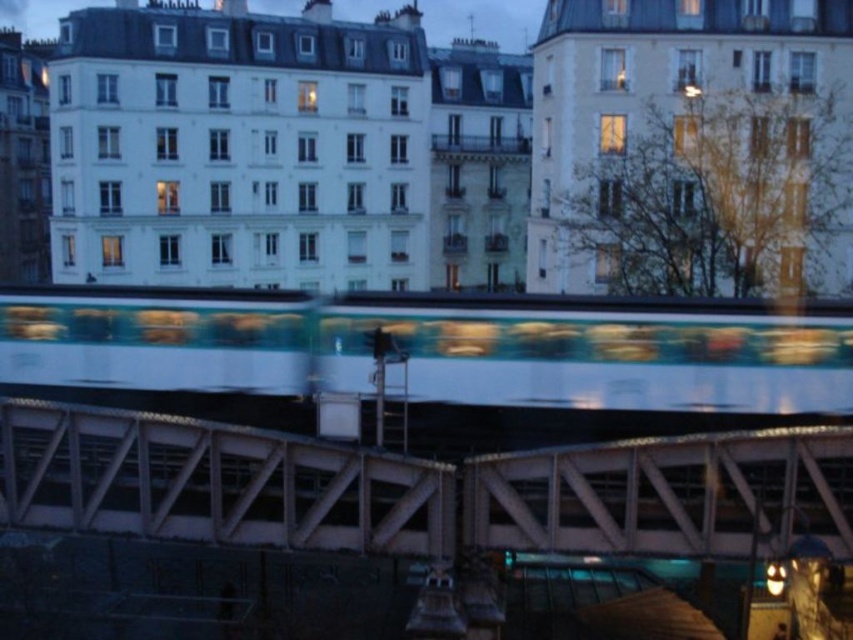
You are a city planner analyzing this urban scene. You need to determine if the metallic bridge at center can support the height of the white glossy subway at center passing underneath it. Based on the image details, what is your conclusion?

The metallic bridge at center has a lesser height compared to the white glossy subway at center. Therefore, the bridge cannot support the subway passing underneath it as the subway is taller than the bridge.

You are a photographer standing on the metallic bridge at center trying to capture a photo of the white glossy subway at center. Can you see the subway through the bridge structure?

The metallic bridge at center is located below the white glossy subway at center, so yes, the photographer can see the subway through the bridge structure since it is positioned above.